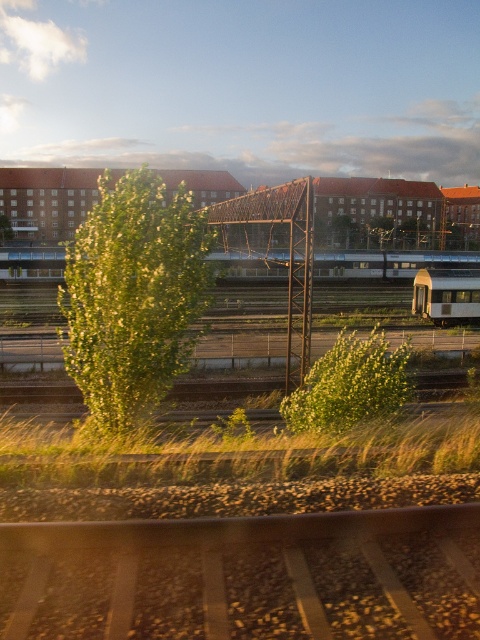
You are a photographer planning to take a photo of the brown gravel train track at bottom and the green leafy tree at left. Which object appears lower in the image?

The brown gravel train track at bottom appears lower in the image than the green leafy tree at left.

You are a photographer standing at the center of the image. You want to capture a photo of the brown gravel train track at bottom. Based on its 2D location, where should you point your camera relative to your current position?

The brown gravel train track at bottom is located at point 0.902 on the x axis and 0.512 on the y axis. Since you are at the center, you need to move your camera to the right and slightly downward to capture it.